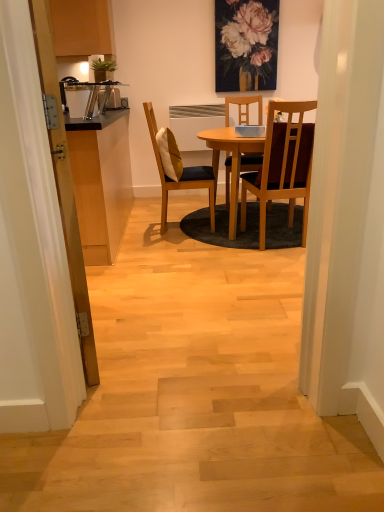
Question: Choose the correct answer: Is wooden cabinet at left inside matte yellow cushioned chair at center, which is the second chair in right-to-left order, or outside it?

Choices:
 (A) inside
 (B) outside

Answer: (B)

Question: Based on their sizes in the image, would you say wooden cabinet at left is bigger or smaller than matte yellow cushioned chair at center, which is the second chair in right-to-left order?

Choices:
 (A) small
 (B) big

Answer: (B)

Question: Estimate the real-world distances between objects in this image. Which object is closer to the wooden cabinet at left?

Choices:
 (A) wooden door at left
 (B) soft yellow cushion at center
 (C) wooden chair at center, positioned as the first chair in right-to-left order
 (D) matte yellow cushioned chair at center, which is the 1th chair from left to right
 (E) matte floral painting at upper center

Answer: (B)

Question: Considering the real-world distances, which object is farthest from the wooden chair at center, positioned as the first chair in right-to-left order?

Choices:
 (A) matte floral painting at upper center
 (B) matte yellow cushioned chair at center, which is the second chair in right-to-left order
 (C) wooden cabinet at left
 (D) soft yellow cushion at center
 (E) wooden door at left

Answer: (E)